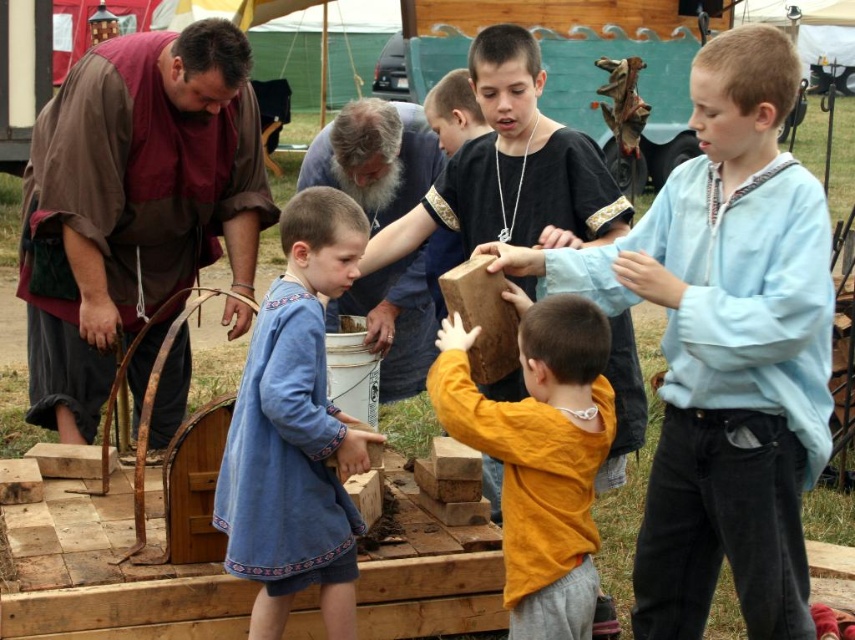
Question: Is wooden block at center smaller than gray beard at center?

Choices:
 (A) no
 (B) yes

Answer: (A)

Question: Which point is farther to the camera?

Choices:
 (A) wooden block at center
 (B) blue cotton dress at center
 (C) light blue cotton shirt at center

Answer: (A)

Question: Among these points, which one is farthest from the camera?

Choices:
 (A) (255, 467)
 (B) (575, 604)
 (C) (612, 344)
 (D) (425, 128)

Answer: (D)

Question: Which point appears farthest from the camera in this image?

Choices:
 (A) (204, 220)
 (B) (576, 518)

Answer: (A)

Question: Is brown leather vest at left smaller than blue cotton dress at center?

Choices:
 (A) yes
 (B) no

Answer: (B)

Question: Does light blue cotton shirt at center have a greater width compared to gray beard at center?

Choices:
 (A) no
 (B) yes

Answer: (B)